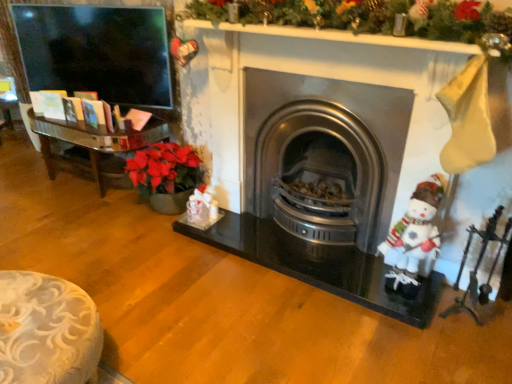
The height and width of the screenshot is (384, 512). I want to click on free area below metallic silver fireplace tools at right (from a real-world perspective), so [457, 320].